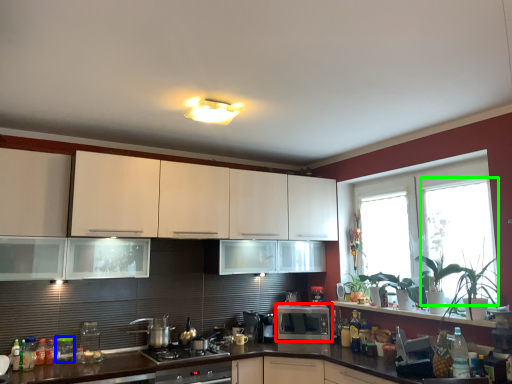
Question: Which is nearer to the microwave oven (highlighted by a red box)? appliance (highlighted by a blue box) or window screen (highlighted by a green box).

Choices:
 (A) appliance
 (B) window screen

Answer: (B)